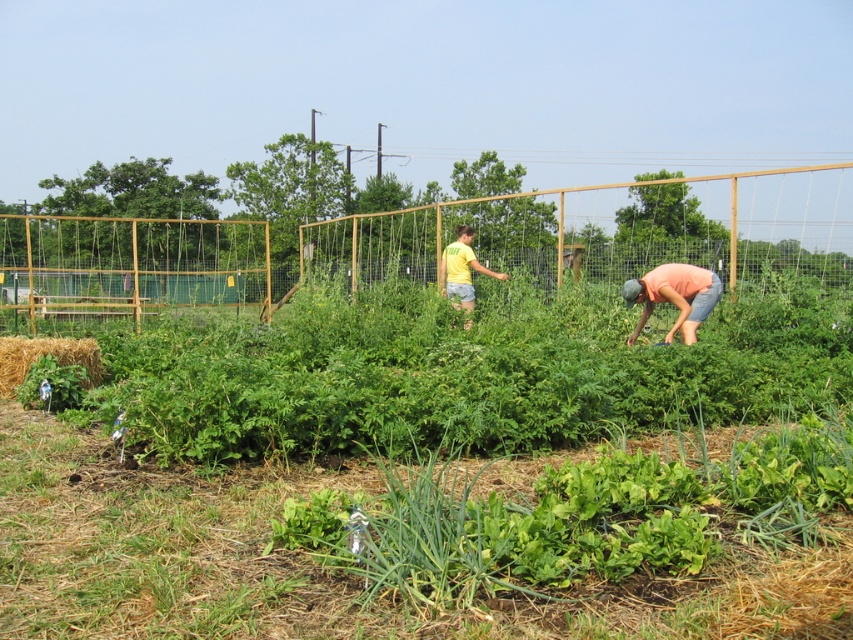
Can you confirm if pink cotton shirt at right is positioned above yellow cotton shirt at center?

Incorrect, pink cotton shirt at right is not positioned above yellow cotton shirt at center.

Does point (625, 298) come behind point (445, 275)?

That is False.

The width and height of the screenshot is (853, 640). What are the coordinates of `pink cotton shirt at right` in the screenshot? It's located at point(677,298).

Is brown straw bale at lower left thinner than yellow cotton shirt at center?

No, brown straw bale at lower left is not thinner than yellow cotton shirt at center.

Consider the image. Is brown straw bale at lower left wider than yellow cotton shirt at center?

Yes.

The width and height of the screenshot is (853, 640). Identify the location of brown straw bale at lower left. (44, 355).

Can you confirm if pink cotton shirt at right is positioned to the right of brown straw bale at lower left?

Yes, pink cotton shirt at right is to the right of brown straw bale at lower left.

Can you confirm if pink cotton shirt at right is positioned below brown straw bale at lower left?

No, pink cotton shirt at right is not below brown straw bale at lower left.

Image resolution: width=853 pixels, height=640 pixels. What do you see at coordinates (677, 298) in the screenshot?
I see `pink cotton shirt at right` at bounding box center [677, 298].

This screenshot has height=640, width=853. I want to click on pink cotton shirt at right, so click(677, 298).